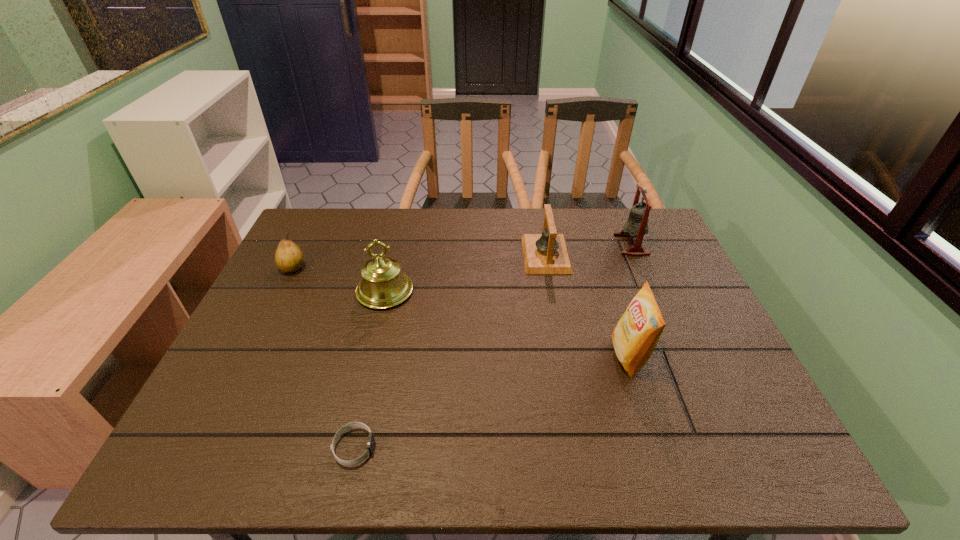
What are the coordinates of `object positioned at the right edge` in the screenshot? It's located at (637, 223).

Locate an element on the screen. object situated at the far right corner is located at coordinates [637, 223].

In the image, there is a desktop. Identify the location of vacant space at the far edge. This screenshot has height=540, width=960. (456, 231).

Where is `free point at the near edge`? The height and width of the screenshot is (540, 960). free point at the near edge is located at coordinates (349, 445).

Where is `blank area at the left edge`? The height and width of the screenshot is (540, 960). blank area at the left edge is located at coordinates (265, 319).

The width and height of the screenshot is (960, 540). Identify the location of free region at the right edge of the desktop. pos(651,253).

The height and width of the screenshot is (540, 960). I want to click on vacant space in between the leftmost bell and the wristband, so click(370, 369).

The image size is (960, 540). Identify the location of vacant region between the rightmost bell and the nearest object. (492, 346).

This screenshot has height=540, width=960. I want to click on free space between the wristband and the leftmost object, so click(324, 357).

In order to click on unoccupied area between the pear and the rightmost object in this screenshot , I will do `click(462, 256)`.